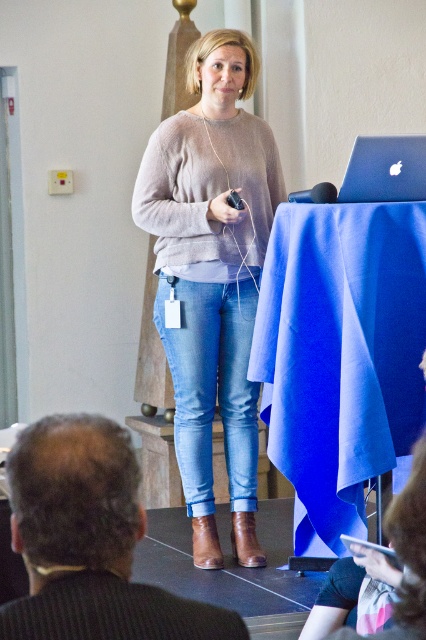
You are an event organizer checking the stage setup. You see the blue fabric at center and the matte beige sweater at center. Which object is lower in height?

The blue fabric at center has a lesser height compared to the matte beige sweater at center, so the blue fabric at center is lower.

Looking at this image, you are an event organizer checking the stage setup. You need to ensure that the denim jeans at center and the sleek silver laptop at upper right are visible to the audience. Based on their heights, which object might block the view of the other?

The denim jeans at center is much taller than the sleek silver laptop at upper right, so the denim jeans at center could block the view of the sleek silver laptop at upper right.

You are an event organizer setting up a stage. You have a blue fabric at center and a matte beige sweater at center. Which item should you place closer to the audience to ensure visibility?

The blue fabric at center should be placed closer to the audience since it is in front of the matte beige sweater at center, ensuring better visibility.